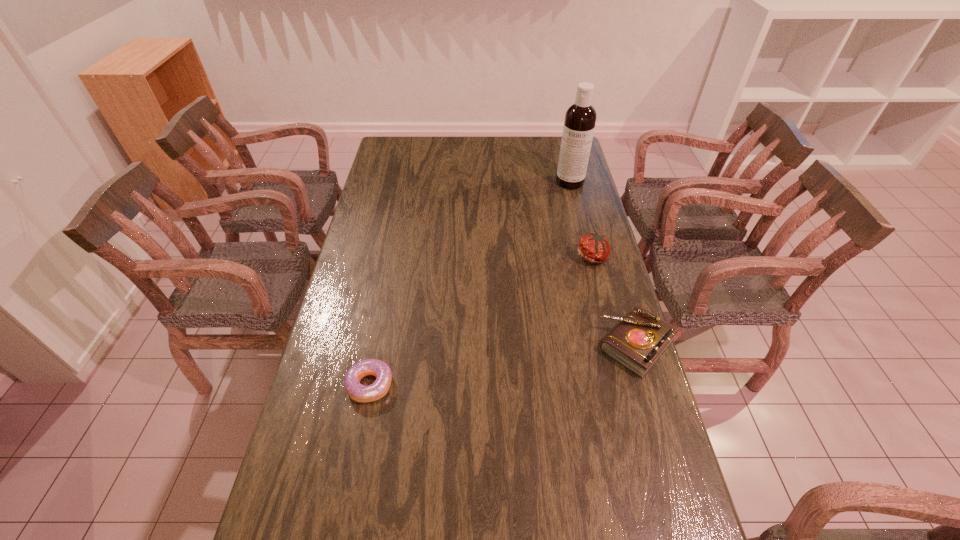
This screenshot has height=540, width=960. I want to click on the leftmost object, so click(x=356, y=391).

The image size is (960, 540). In order to click on doughnut in this screenshot , I will do `click(356, 391)`.

This screenshot has height=540, width=960. What are the coordinates of `the second shortest object` in the screenshot? It's located at (639, 340).

Locate an element on the screen. The width and height of the screenshot is (960, 540). tomato is located at coordinates [x=594, y=248].

I want to click on the third nearest object, so click(x=594, y=248).

The image size is (960, 540). Find the location of `the tallest object`. the tallest object is located at coordinates (580, 118).

Where is `the farthest object`? This screenshot has height=540, width=960. the farthest object is located at coordinates (580, 118).

At what (x,y) coordinates should I click in order to perform the action: click on vacant space situated on the back of the doughnut. Please return your answer as a coordinate pair (x, y). The image size is (960, 540). Looking at the image, I should click on (388, 293).

The height and width of the screenshot is (540, 960). In order to click on free space located on the back of the second shortest object in this screenshot , I will do `click(619, 285)`.

Identify the location of free space located on the front-facing side of the third shortest object. The image size is (960, 540). (526, 319).